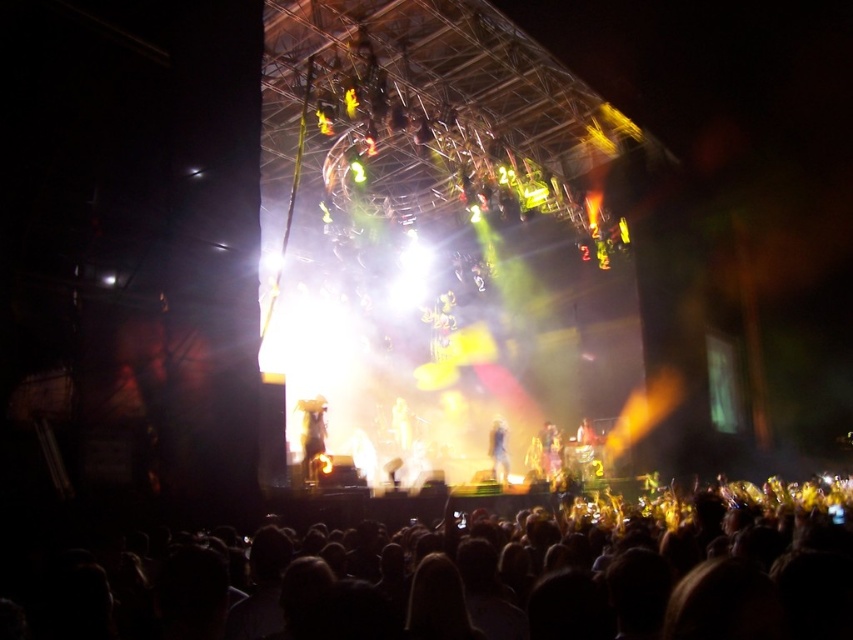
Describe the element at coordinates (508, 573) in the screenshot. I see `dark hair at lower center` at that location.

Who is higher up, dark hair at lower center or smooth skin figure at center?

Positioned higher is smooth skin figure at center.

Where is `dark hair at lower center`? This screenshot has width=853, height=640. dark hair at lower center is located at coordinates 508,573.

The width and height of the screenshot is (853, 640). Find the location of `dark hair at lower center`. dark hair at lower center is located at coordinates (508, 573).

Can you confirm if smooth skin figure at center is smaller than smooth white statue at center?

Actually, smooth skin figure at center might be larger than smooth white statue at center.

Who is higher up, smooth skin figure at center or smooth white statue at center?

Positioned higher is smooth skin figure at center.

Is point (490, 442) closer to viewer compared to point (396, 416)?

Yes, it is.

The height and width of the screenshot is (640, 853). I want to click on smooth skin figure at center, so click(x=498, y=451).

Is point (630, 504) closer to camera compared to point (407, 424)?

That is True.

Can you confirm if dark hair at lower center is shorter than smooth white statue at center?

No.

I want to click on dark hair at lower center, so click(508, 573).

You are a GUI agent. You are given a task and a screenshot of the screen. Output one action in this format:
    pyautogui.click(x=<x>, y=<y>)
    Task: Click on the dark hair at lower center
    Image resolution: width=853 pixels, height=640 pixels.
    Given the screenshot: What is the action you would take?
    pyautogui.click(x=508, y=573)